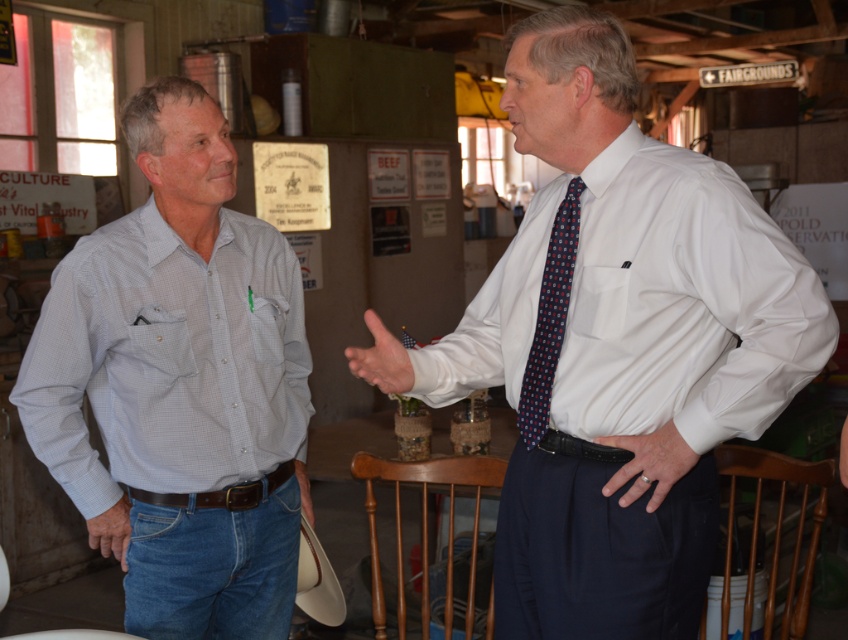
Question: Which of the following is the farthest from the observer?

Choices:
 (A) leather glove at lower left
 (B) white leather hand at center
 (C) smooth skin hand at center
 (D) light blue checkered shirt at center

Answer: (A)

Question: Can you confirm if light blue checkered shirt at center is bigger than white smooth shirt at right?

Choices:
 (A) no
 (B) yes

Answer: (B)

Question: Where is white smooth shirt at center located in relation to white leather hand at center in the image?

Choices:
 (A) left
 (B) right

Answer: (A)

Question: Can you confirm if light blue checkered shirt at center is bigger than smooth skin hand at center?

Choices:
 (A) no
 (B) yes

Answer: (B)

Question: Among these points, which one is farthest from the camera?

Choices:
 (A) (564, 269)
 (B) (642, 438)

Answer: (A)

Question: Among these objects, which one is nearest to the camera?

Choices:
 (A) light blue checkered shirt at center
 (B) blue dotted tie at right
 (C) leather glove at lower left

Answer: (B)